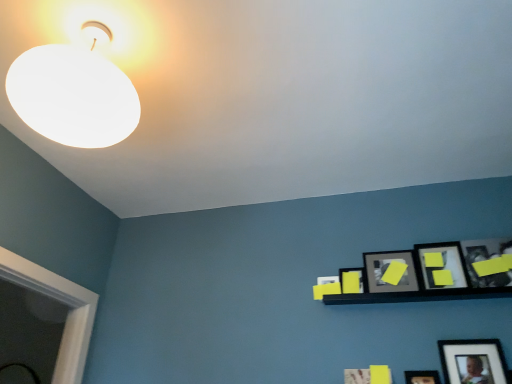
Question: From the image's perspective, is matte black picture frame at lower right, positioned as the fourth picture frame in left-to-right order, on top of matte black picture frame at upper right, which ranks as the fourth picture frame in right-to-left order?

Choices:
 (A) no
 (B) yes

Answer: (A)

Question: Is there a large distance between matte black picture frame at lower right, the second picture frame in the right-to-left sequence, and matte black picture frame at upper right, which ranks as the fourth picture frame in right-to-left order?

Choices:
 (A) yes
 (B) no

Answer: (B)

Question: From a real-world perspective, is matte black picture frame at lower right, the second picture frame in the right-to-left sequence, located beneath matte black picture frame at upper right, which ranks as the fourth picture frame in right-to-left order?

Choices:
 (A) no
 (B) yes

Answer: (B)

Question: Is matte black picture frame at lower right, the second picture frame in the right-to-left sequence, in front of matte black picture frame at upper right, placed as the 2th picture frame when sorted from left to right?

Choices:
 (A) yes
 (B) no

Answer: (A)

Question: Can you confirm if matte black picture frame at lower right, positioned as the fourth picture frame in left-to-right order, is wider than matte black picture frame at upper right, which ranks as the fourth picture frame in right-to-left order?

Choices:
 (A) yes
 (B) no

Answer: (B)

Question: From a real-world perspective, is matte black picture frame at lower right, positioned as the fourth picture frame in left-to-right order, physically above matte black picture frame at upper right, placed as the 2th picture frame when sorted from left to right?

Choices:
 (A) no
 (B) yes

Answer: (A)

Question: Does yellow matte picture frame at upper right, the first picture frame viewed from the left, have a smaller size compared to white matte lampshade at upper left?

Choices:
 (A) no
 (B) yes

Answer: (B)

Question: From the image's perspective, is yellow matte picture frame at upper right, the fifth picture frame when ordered from right to left, located beneath white matte lampshade at upper left?

Choices:
 (A) no
 (B) yes

Answer: (B)

Question: From the image's perspective, is yellow matte picture frame at upper right, the first picture frame viewed from the left, on white matte lampshade at upper left?

Choices:
 (A) yes
 (B) no

Answer: (B)

Question: Considering the relative sizes of yellow matte picture frame at upper right, the first picture frame viewed from the left, and white matte lampshade at upper left in the image provided, is yellow matte picture frame at upper right, the first picture frame viewed from the left, bigger than white matte lampshade at upper left?

Choices:
 (A) yes
 (B) no

Answer: (B)

Question: Does yellow matte picture frame at upper right, the first picture frame viewed from the left, come behind white matte lampshade at upper left?

Choices:
 (A) yes
 (B) no

Answer: (A)

Question: Would you consider yellow matte picture frame at upper right, the first picture frame viewed from the left, to be distant from white matte lampshade at upper left?

Choices:
 (A) no
 (B) yes

Answer: (B)

Question: Is white matte lampshade at upper left smaller than yellow matte picture frame at upper right, placed as the 3th picture frame when sorted from right to left?

Choices:
 (A) no
 (B) yes

Answer: (A)